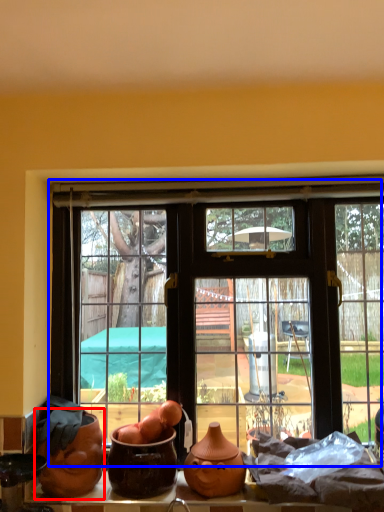
Question: Which object appears farthest to the camera in this image, pottery (highlighted by a red box) or window (highlighted by a blue box)?

Choices:
 (A) pottery
 (B) window

Answer: (B)